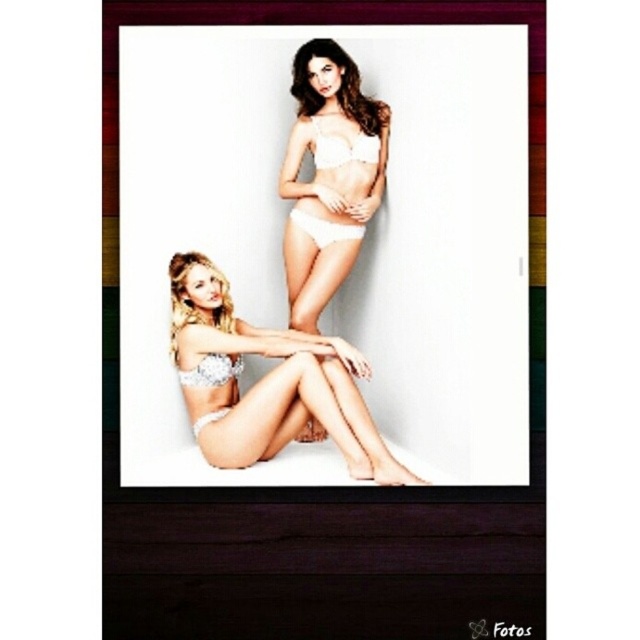
Question: Which point is farther to the camera?

Choices:
 (A) (321, 243)
 (B) (289, 387)

Answer: (A)

Question: Does white satin lingerie at center appear under white lace underwear at upper center?

Choices:
 (A) yes
 (B) no

Answer: (B)

Question: Which is farther from the white lace lingerie at lower left?

Choices:
 (A) white lace bikini top at upper center
 (B) white matte bikini at upper center
 (C) white satin lingerie at center
 (D) white matte bra at upper center

Answer: (D)

Question: Does white matte bra at upper center come in front of white lace bikini top at upper center?

Choices:
 (A) yes
 (B) no

Answer: (A)

Question: Is white satin lingerie at center wider than white lace bikini top at upper center?

Choices:
 (A) no
 (B) yes

Answer: (B)

Question: Estimate the real-world distances between objects in this image. Which object is farther from the white matte bikini at upper center?

Choices:
 (A) white lace lingerie at lower left
 (B) white lace underwear at upper center
 (C) white lace bikini top at upper center

Answer: (A)